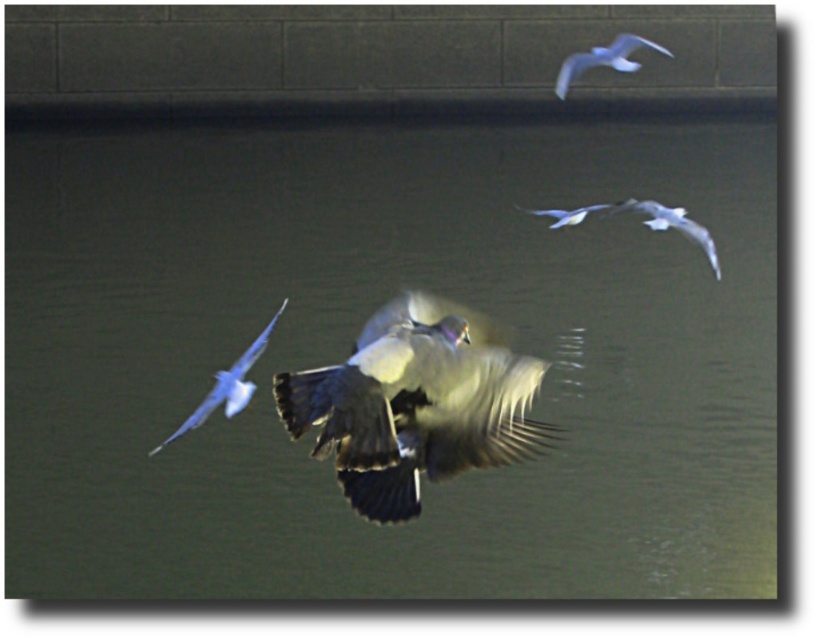
Question: Which of the following is the closest to the observer?

Choices:
 (A) (654, 200)
 (B) (445, 328)
 (C) (565, 211)
 (D) (609, 438)

Answer: (B)

Question: Does smooth water at center have a smaller size compared to gray feathered bird at center?

Choices:
 (A) no
 (B) yes

Answer: (A)

Question: Which of the following is the closest to the observer?

Choices:
 (A) (709, 237)
 (B) (246, 394)

Answer: (B)

Question: Which of the following is the closest to the observer?

Choices:
 (A) (583, 218)
 (B) (599, 52)

Answer: (A)

Question: Does gray feathered bird at center have a greater width compared to white feathered bird at left?

Choices:
 (A) no
 (B) yes

Answer: (A)

Question: Does smooth water at center have a lesser width compared to gray feathered bird at center?

Choices:
 (A) no
 (B) yes

Answer: (A)